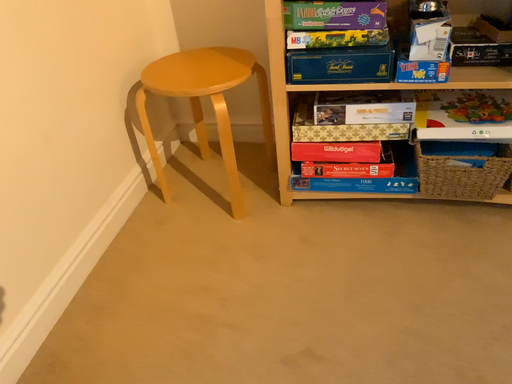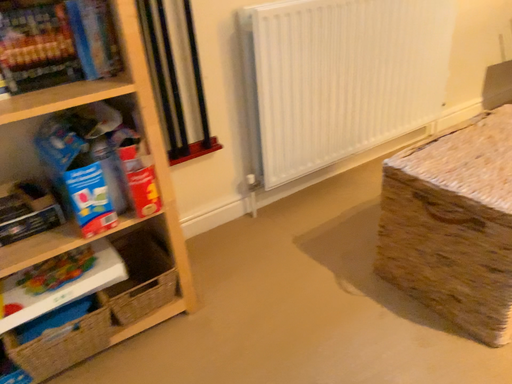
Question: How did the camera likely rotate when shooting the video?

Choices:
 (A) rotated downward
 (B) rotated upward

Answer: (B)